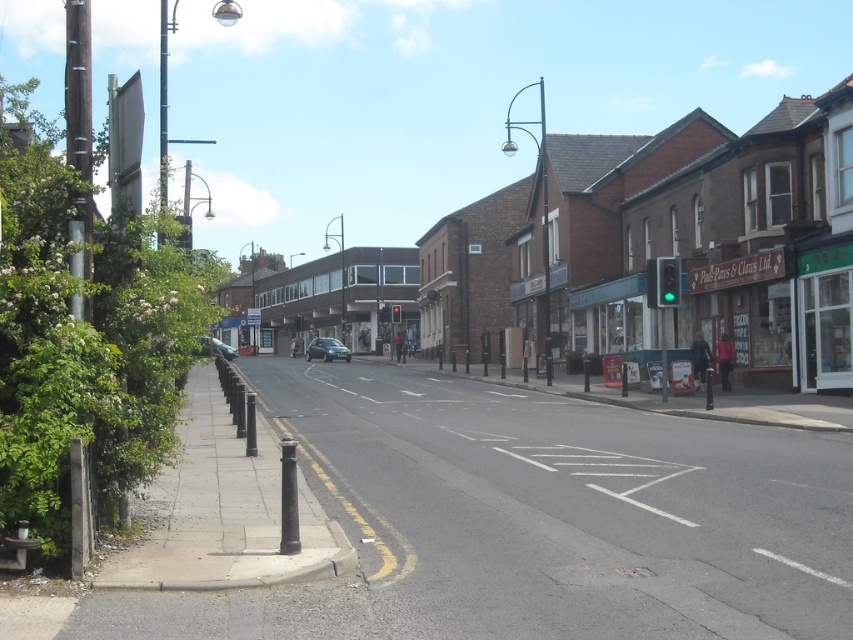
In the scene shown: You are a delivery person who needs to park your metallic silver car at center in front of the brown brick building at center. Considering the height difference between them, would the building block the sunlight from reaching your car if parked there?

The brown brick building at center is much taller than the metallic silver car at center, so yes, the building would likely block sunlight from reaching the car if parked there.

You are standing on the sidewalk and see two points marked on the road. The first point is at coordinates point (322, 300) and the second point is at point (322, 346). Which point is closer to your current position on the sidewalk?

Point (322, 300) is further to the camera than point (322, 346). Therefore, the point closer to your position on the sidewalk is point (322, 346).